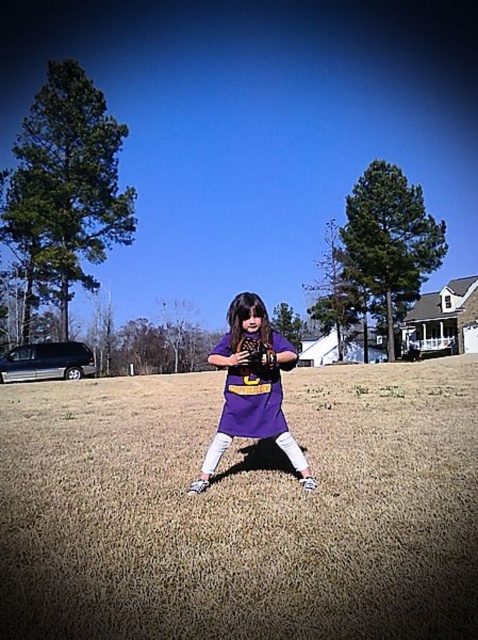
You are a photographer trying to capture the girl in the image while ensuring the background remains in focus. The camera has a depth of field setting that requires the subject to be within a certain distance from the background. If the brown dry grass at center is located at point (241, 509), can you determine if the girl is positioned close enough to the background for the background to stay sharp?

The brown dry grass at center is located at point (241, 509), but without knowing the exact distance between the girl and the background, it is impossible to determine if the background will stay sharp. More information about their separation is needed.

You are a sports equipment organizer who needs to place two baseball gloves in a storage box. The box has a width of 15 inches. You see the purple matte baseball glove at center and the black leather baseball glove at center. Can both gloves fit side by side in the box without overlapping?

The distance between the purple matte baseball glove at center and the black leather baseball glove at center is 15.33 inches. Since the box is only 15 inches wide, the gloves cannot fit side by side without overlapping.

You are a photographer trying to capture a closeup of the purple matte baseball glove at center while also including the brown dry grass at center in the shot. Which object should you focus on to ensure both are in the frame?

The brown dry grass at center is closer to the viewer than the purple matte baseball glove at center, so focusing on the brown dry grass at center will ensure both objects are in the frame.